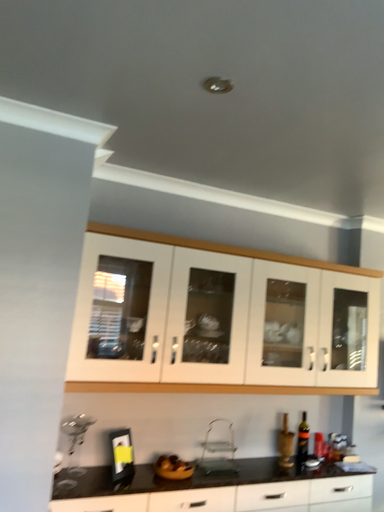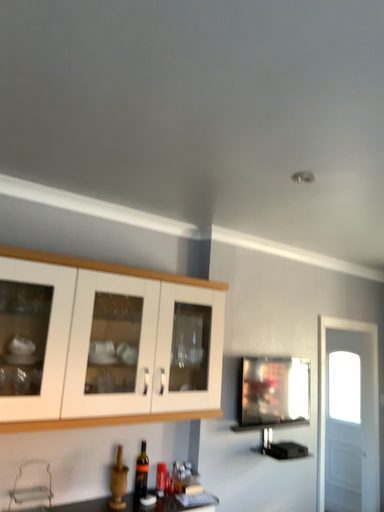
Question: Which way did the camera rotate in the video?

Choices:
 (A) rotated right
 (B) rotated left

Answer: (A)